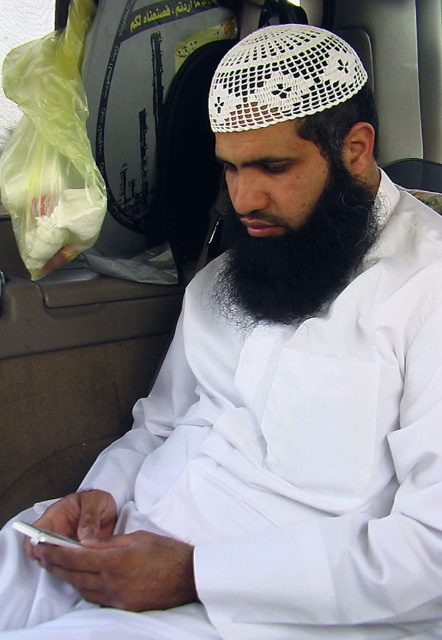
You are a passenger in the vehicle and want to read the white paper sign at upper center. However, the black matte beard at center is blocking your view. Can you move the beard to see the sign?

The black matte beard at center is in front of the white paper sign at upper center, so moving the beard would allow you to see the sign.

You are a delivery person who needs to attach a label to a package. The label must be placed exactly 30 inches away from the black matte beard at center. Is the white paper sign at upper center a suitable location for the label?

The black matte beard at center is 28.11 inches from the white paper sign at upper center. Since the required distance is 30 inches, the white paper sign at upper center is too close and not suitable for placing the label.